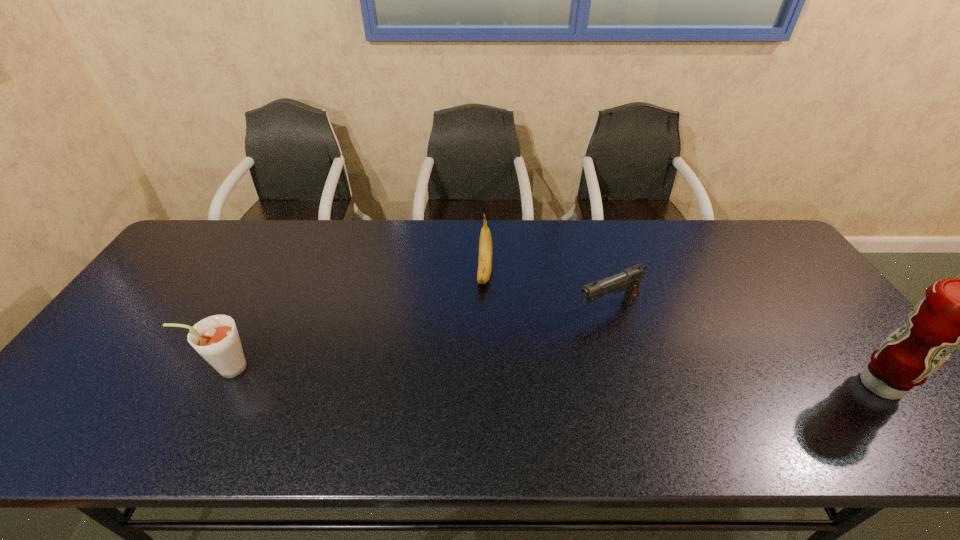
Identify the location of root beer. Image resolution: width=960 pixels, height=540 pixels. (216, 338).

In order to click on the rightmost object in this screenshot , I will do `click(956, 312)`.

Where is `condiment`? The image size is (960, 540). condiment is located at coordinates (956, 312).

Where is `gun`? The width and height of the screenshot is (960, 540). gun is located at coordinates (629, 279).

Locate an element on the screen. This screenshot has width=960, height=540. the shortest object is located at coordinates tap(629, 279).

You are a GUI agent. You are given a task and a screenshot of the screen. Output one action in this format:
    pyautogui.click(x=<x>, y=<y>)
    Task: Click on the banana
    
    Given the screenshot: What is the action you would take?
    pyautogui.click(x=485, y=242)

The height and width of the screenshot is (540, 960). In order to click on the second object from left to right in this screenshot , I will do `click(485, 242)`.

Locate an element on the screen. This screenshot has width=960, height=540. vacant space located on the drink side of the leftmost object is located at coordinates (156, 368).

This screenshot has width=960, height=540. I want to click on free region located 0.230m on the drink side of the leftmost object, so click(x=108, y=368).

Find the location of a particular element. The height and width of the screenshot is (540, 960). vacant space located 0.070m on the drink side of the leftmost object is located at coordinates (173, 368).